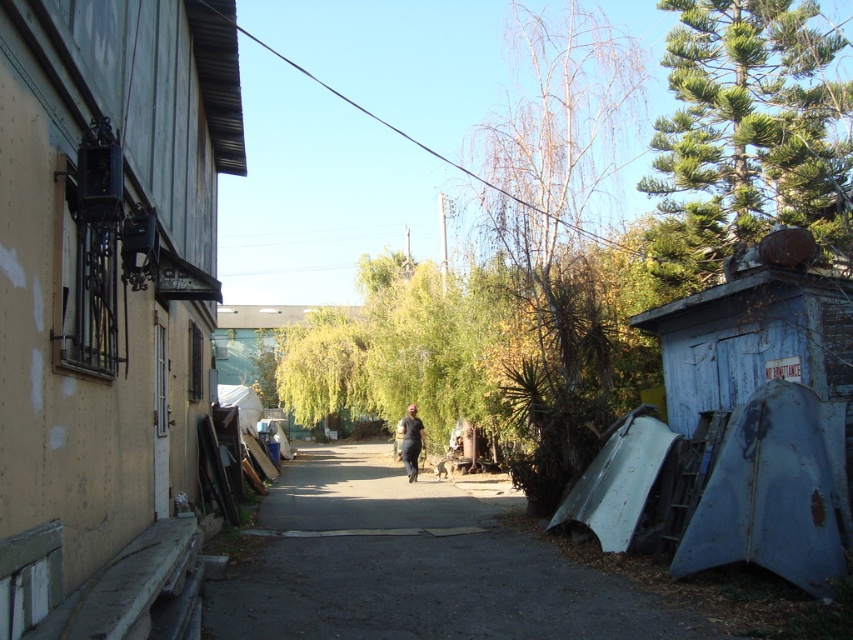
You are standing at the entrance of the alleyway and want to walk to the shed on the right side. Which direction should you walk to avoid the smooth concrete alley at center?

You should walk to the right side of the alley to avoid the smooth concrete alley at center, as the shed is located on the right side of the alleyway.

You are a painter setting up an easel in the narrow alleyway. You want to capture the green textured pine tree at upper right and the dark gray fabric pants at center in your painting. Considering their sizes, which object should you place closer to the front of your painting to maintain perspective?

The dark gray fabric pants at center should be placed closer to the front of the painting because it is smaller in size compared to the green textured pine tree at upper right, which helps create a sense of depth and perspective.